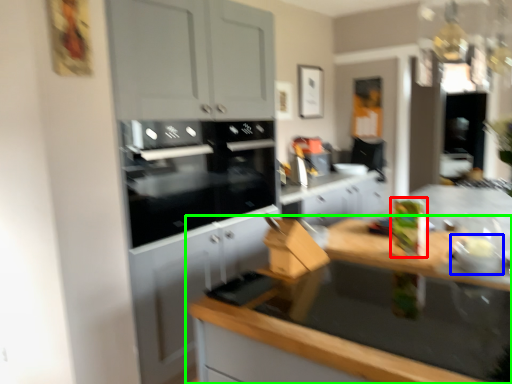
Question: Based on their relative distances, which object is nearer to appliance (highlighted by a red box)? Choose from appliance (highlighted by a blue box) and countertop (highlighted by a green box).

Choices:
 (A) appliance
 (B) countertop

Answer: (A)